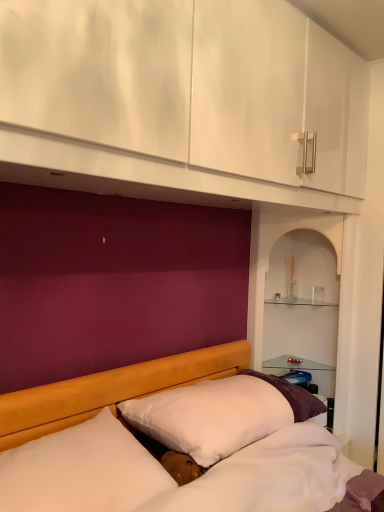
Question: Does clear glass shelf at upper center, placed as the 1th shelf when sorted from top to bottom, appear on the left side of white soft pillow at lower left, positioned as the 2th pillow in back-to-front order?

Choices:
 (A) yes
 (B) no

Answer: (B)

Question: Could white soft pillow at lower left, positioned as the 2th pillow in back-to-front order, be considered to be inside clear glass shelf at upper center, the 2th shelf when ordered from bottom to top?

Choices:
 (A) yes
 (B) no

Answer: (B)

Question: Is clear glass shelf at upper center, the 2th shelf when ordered from bottom to top, taller than white soft pillow at lower left, the first pillow from the front?

Choices:
 (A) yes
 (B) no

Answer: (B)

Question: From the image's perspective, is clear glass shelf at upper center, the 2th shelf when ordered from bottom to top, on white soft pillow at lower left, positioned as the 2th pillow in back-to-front order?

Choices:
 (A) yes
 (B) no

Answer: (A)

Question: From a real-world perspective, is clear glass shelf at upper center, the 2th shelf when ordered from bottom to top, positioned under white soft pillow at lower left, the first pillow from the front, based on gravity?

Choices:
 (A) yes
 (B) no

Answer: (B)

Question: From a real-world perspective, is clear glass shelf at upper center, the 2th shelf when ordered from bottom to top, physically above white soft pillow at lower left, positioned as the 2th pillow in back-to-front order?

Choices:
 (A) no
 (B) yes

Answer: (B)

Question: Considering the relative sizes of white soft pillow at lower left, the first pillow from the front, and white soft pillow at center, the second pillow in the front-to-back sequence, in the image provided, is white soft pillow at lower left, the first pillow from the front, bigger than white soft pillow at center, the second pillow in the front-to-back sequence,?

Choices:
 (A) yes
 (B) no

Answer: (B)

Question: Is white soft pillow at lower left, positioned as the 2th pillow in back-to-front order, surrounding white soft pillow at center, the 1th pillow when ordered from back to front?

Choices:
 (A) yes
 (B) no

Answer: (B)

Question: Is white soft pillow at lower left, positioned as the 2th pillow in back-to-front order, in front of white soft pillow at center, the 1th pillow when ordered from back to front?

Choices:
 (A) no
 (B) yes

Answer: (B)

Question: Is white soft pillow at lower left, positioned as the 2th pillow in back-to-front order, taller than white soft pillow at center, the second pillow in the front-to-back sequence?

Choices:
 (A) no
 (B) yes

Answer: (B)

Question: Is white soft pillow at lower left, positioned as the 2th pillow in back-to-front order, not within white soft pillow at center, the second pillow in the front-to-back sequence?

Choices:
 (A) yes
 (B) no

Answer: (A)

Question: From a real-world perspective, is white soft pillow at lower left, the first pillow from the front, on white soft pillow at center, the 1th pillow when ordered from back to front?

Choices:
 (A) yes
 (B) no

Answer: (B)

Question: From the image's perspective, is clear glass shelves at right, which ranks as the 2th shelf in top-to-bottom order, above white soft pillow at center, the second pillow in the front-to-back sequence?

Choices:
 (A) yes
 (B) no

Answer: (A)